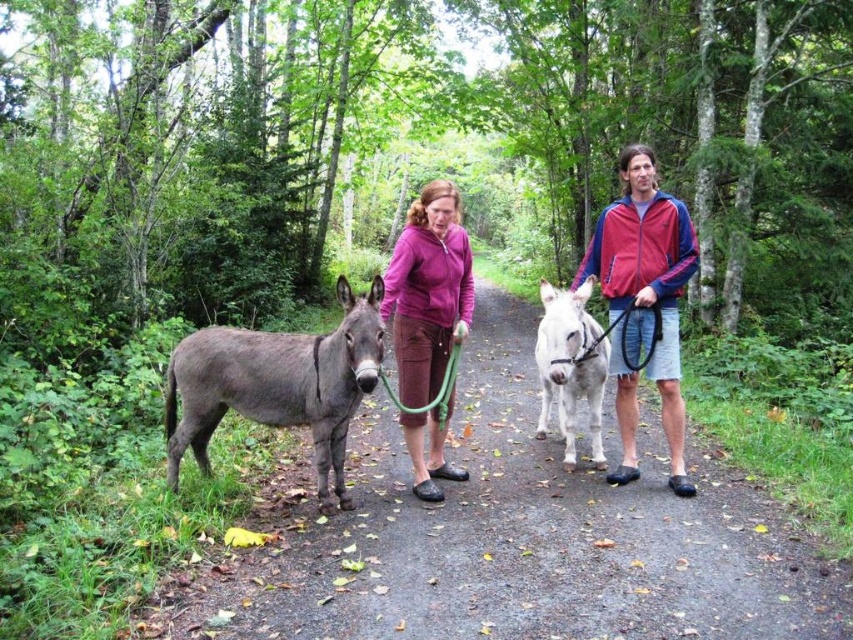
You are standing at the point marked as point (643, 301) in the image. Looking around, you see two people walking their donkeys along the path. Which jacket color combination are you wearing if you are at that point?

The point (643, 301) is on the red and purple jacket at center, so you are wearing a red and purple jacket.

You are a hiker trying to follow the path in the forest. You see a smooth dirt path at center and a gray matte mule at left. Which direction should you walk to stay on the path?

The smooth dirt path at center is to the right of the gray matte mule at left. To stay on the path, you should walk towards the right direction from the gray matte mule at left.